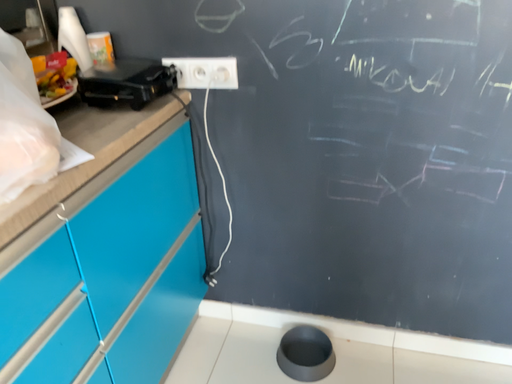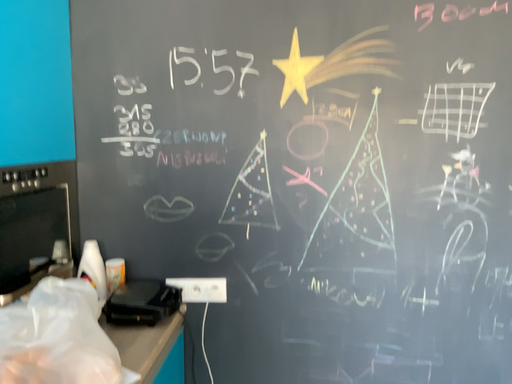
Question: Which way did the camera rotate in the video?

Choices:
 (A) rotated downward
 (B) rotated upward

Answer: (B)